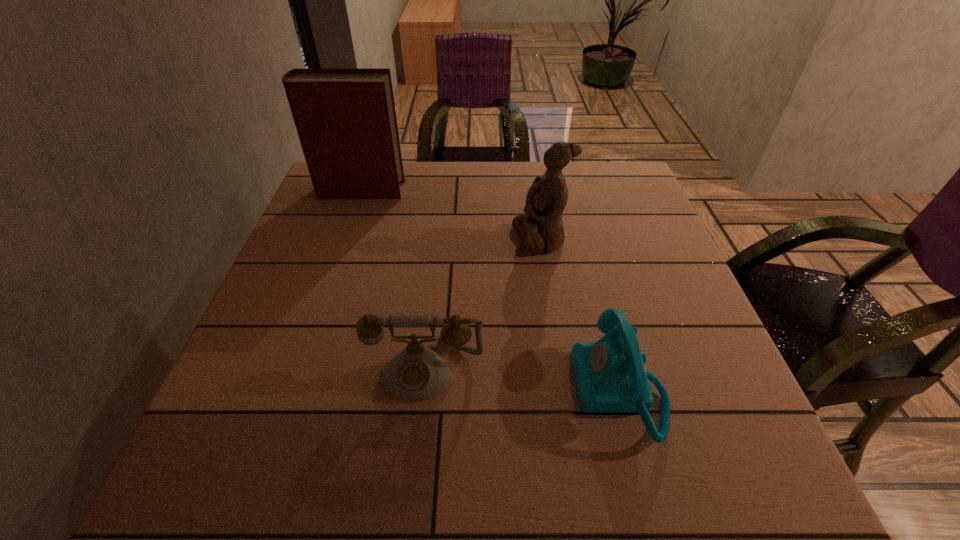
This screenshot has width=960, height=540. Identify the location of unoccupied position between the leftmost object and the figurine. (450, 215).

What are the coordinates of `vacant area that lies between the left telephone and the right telephone` in the screenshot? It's located at [522, 381].

Find the location of a particular element. free space between the figurine and the right telephone is located at coordinates (580, 314).

At what (x,y) coordinates should I click in order to perform the action: click on free space between the right telephone and the left telephone. Please return your answer as a coordinate pair (x, y). The width and height of the screenshot is (960, 540). Looking at the image, I should click on (522, 381).

The width and height of the screenshot is (960, 540). I want to click on unoccupied position between the farthest object and the figurine, so pos(450,215).

Identify which object is the third closest to the figurine. Please provide its 2D coordinates. Your answer should be formatted as a tuple, i.e. [(x, y)], where the tuple contains the x and y coordinates of a point satisfying the conditions above.

[(345, 118)]

Point out which object is positioned as the third nearest to the left telephone. Please provide its 2D coordinates. Your answer should be formatted as a tuple, i.e. [(x, y)], where the tuple contains the x and y coordinates of a point satisfying the conditions above.

[(345, 118)]

The height and width of the screenshot is (540, 960). Identify the location of vacant area that satisfies the following two spatial constraints: 1. on the front-facing side of the figurine; 2. on the dial of the second object from left to right. (561, 372).